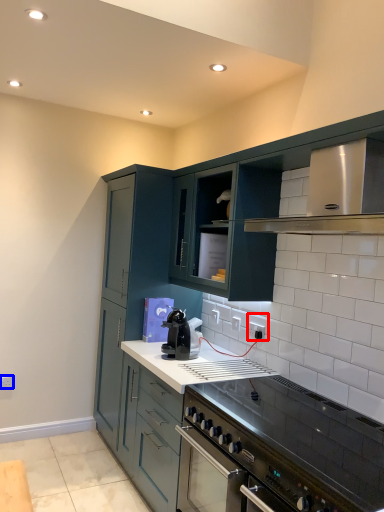
Question: Which object appears closest to the camera in this image, electric outlet (highlighted by a red box) or electric outlet (highlighted by a blue box)?

Choices:
 (A) electric outlet
 (B) electric outlet

Answer: (A)